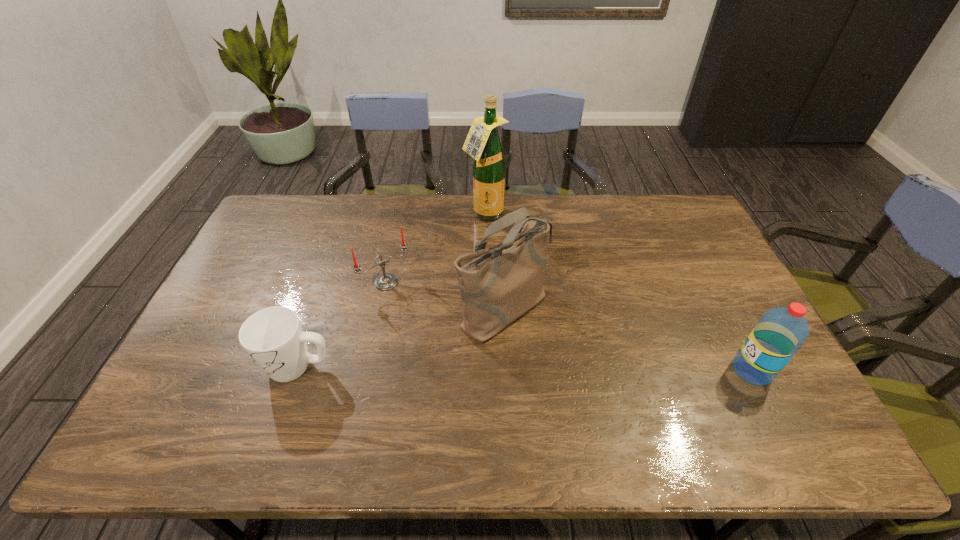
Find the location of a particular element. object that is the second nearest to the candle is located at coordinates (273, 337).

Find the location of `vacant space that satisfies the following two spatial constraints: 1. on the front side of the rightmost object; 2. on the front label of the liquor`. vacant space that satisfies the following two spatial constraints: 1. on the front side of the rightmost object; 2. on the front label of the liquor is located at coordinates (486, 370).

I want to click on vacant point that satisfies the following two spatial constraints: 1. on the front side of the candle; 2. on the right side of the shoulder bag, so click(381, 309).